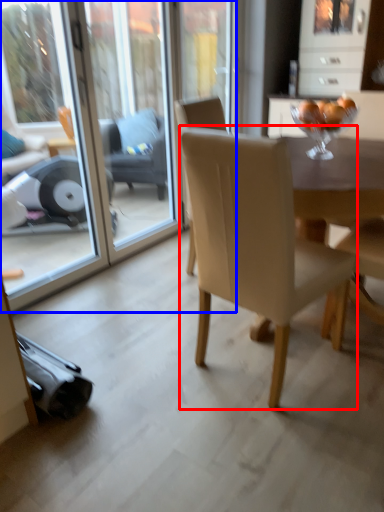
Question: Which object is closer to the camera taking this photo, chair (highlighted by a red box) or screen door (highlighted by a blue box)?

Choices:
 (A) chair
 (B) screen door

Answer: (A)